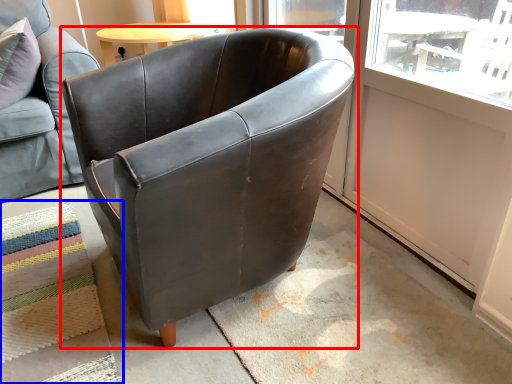
Question: Which point is closer to the camera, chair (highlighted by a red box) or mat (highlighted by a blue box)?

Choices:
 (A) chair
 (B) mat

Answer: (A)